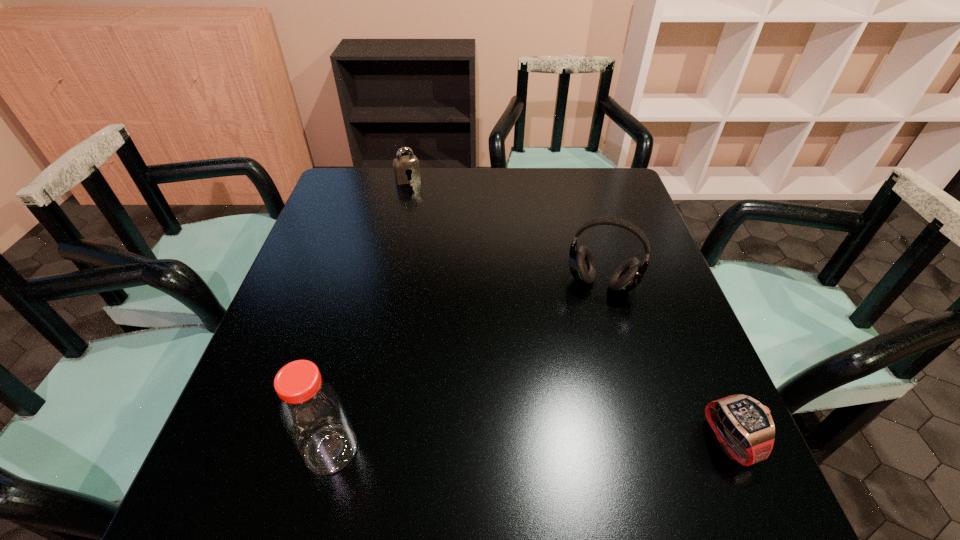
Locate an element on the screen. The image size is (960, 540). vacant space on the desktop that is between the bottle and the shortest object and is positioned on the ear cups of the second object from right to left is located at coordinates (556, 444).

Locate an element on the screen. free space on the desktop that is between the bottle and the rightmost object and is positioned at the front of the third tallest object near the keyhole is located at coordinates (572, 444).